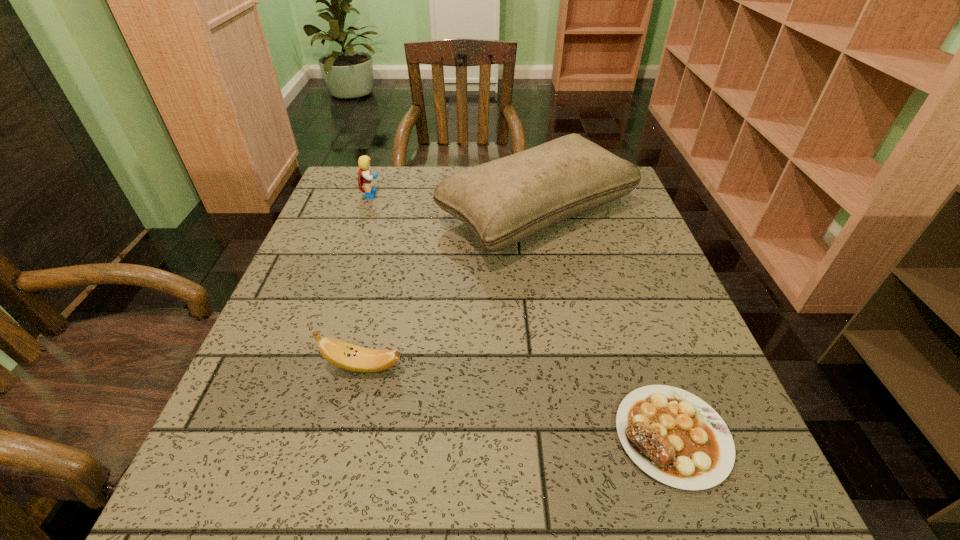
Locate an element on the screen. cushion located at the far edge is located at coordinates (504, 201).

Locate an element on the screen. Lego at the far edge is located at coordinates [x=366, y=178].

Where is `object located at the near edge`? object located at the near edge is located at coordinates (675, 437).

Identify the location of Lego present at the left edge. The height and width of the screenshot is (540, 960). (366, 178).

Identify the location of banana that is positioned at the left edge. This screenshot has height=540, width=960. (341, 354).

Find the location of a particular element. cushion located at the right edge is located at coordinates (504, 201).

Find the location of a particular element. steak that is at the right edge is located at coordinates (675, 437).

At what (x,y) coordinates should I click in order to perform the action: click on object at the far left corner. Please return your answer as a coordinate pair (x, y). The image size is (960, 540). Looking at the image, I should click on (366, 178).

This screenshot has height=540, width=960. I want to click on object that is at the far right corner, so click(504, 201).

Locate an element on the screen. Image resolution: width=960 pixels, height=540 pixels. object situated at the near right corner is located at coordinates (675, 437).